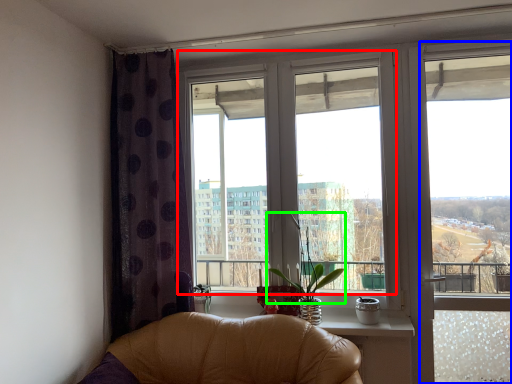
Question: Considering the real-world distances, which object is closest to window (highlighted by a red box)? window frame (highlighted by a blue box) or plant (highlighted by a green box).

Choices:
 (A) window frame
 (B) plant

Answer: (B)